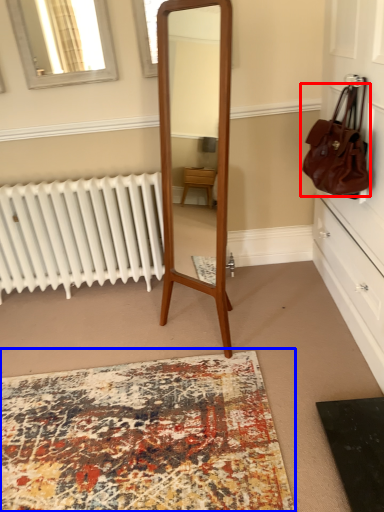
Question: Which object is closer to the camera taking this photo, handbag (highlighted by a red box) or mat (highlighted by a blue box)?

Choices:
 (A) handbag
 (B) mat

Answer: (B)